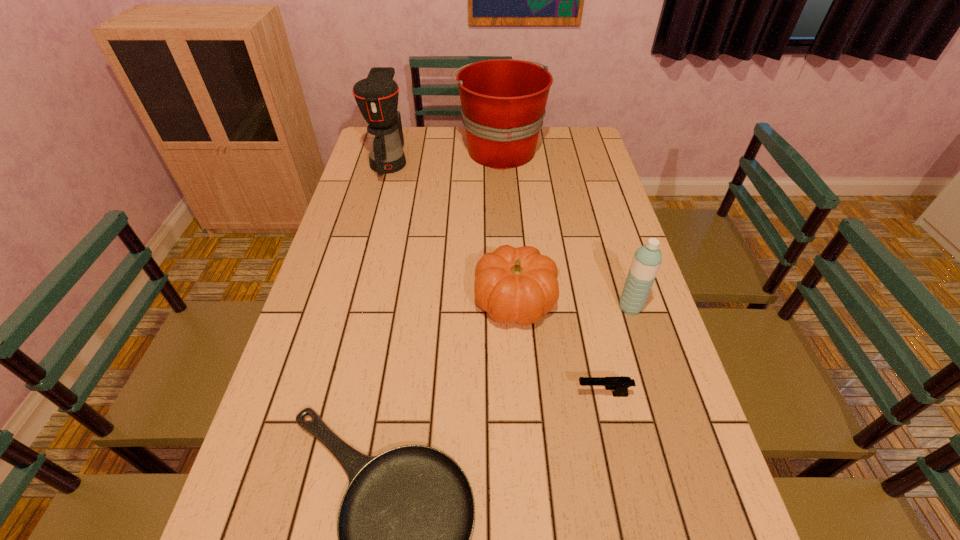
Identify the location of coffee maker. (377, 95).

In order to click on bucket in this screenshot , I will do `click(503, 101)`.

Image resolution: width=960 pixels, height=540 pixels. In order to click on the rightmost object in this screenshot , I will do `click(647, 259)`.

In order to click on the third tallest object in this screenshot , I will do `click(647, 259)`.

Where is `the fourth tallest object`? the fourth tallest object is located at coordinates (512, 284).

Locate an element on the screen. The image size is (960, 540). pistol is located at coordinates click(620, 385).

Image resolution: width=960 pixels, height=540 pixels. Find the location of `the second nearest object`. the second nearest object is located at coordinates (620, 385).

Identify the location of free space located 0.290m pour from the carafe of the coffee maker. The width and height of the screenshot is (960, 540). (368, 240).

At what (x,y) coordinates should I click in order to perform the action: click on blank area located 0.350m on the left of the bucket. Please return your answer as a coordinate pair (x, y). This screenshot has width=960, height=540. Looking at the image, I should click on (364, 150).

What are the coordinates of `free space located 0.350m on the front of the rightmost object` in the screenshot? It's located at (675, 454).